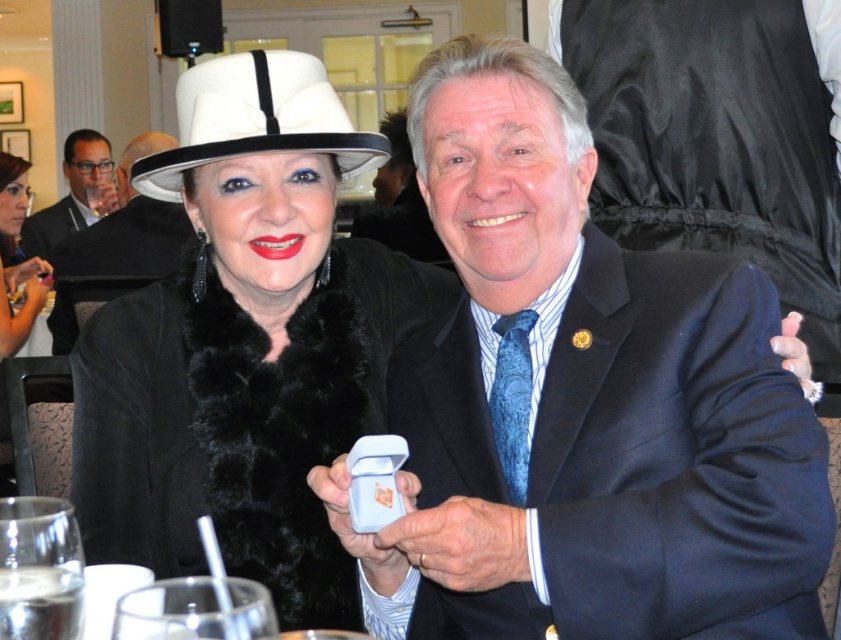
Question: Is blue satin suit at center closer to camera compared to matte black hat at upper left?

Choices:
 (A) yes
 (B) no

Answer: (A)

Question: Which object appears closest to the camera in this image?

Choices:
 (A) fur coat at upper left
 (B) blue satin suit at center
 (C) white felt dress hat at upper left
 (D) matte black hat at upper left

Answer: (B)

Question: Which of these objects is positioned farthest from the blue satin suit at center?

Choices:
 (A) fur coat at upper left
 (B) white fur coat at center
 (C) matte black suit at upper left

Answer: (C)

Question: Is fur coat at upper left closer to the viewer compared to matte black suit at upper left?

Choices:
 (A) no
 (B) yes

Answer: (B)

Question: Which object is the closest to the matte black hat at upper left?

Choices:
 (A) white fur coat at center
 (B) fur coat at upper left
 (C) matte black suit at upper left
 (D) blue satin suit at center

Answer: (B)

Question: Is white fur coat at center behind matte black suit at upper left?

Choices:
 (A) no
 (B) yes

Answer: (A)